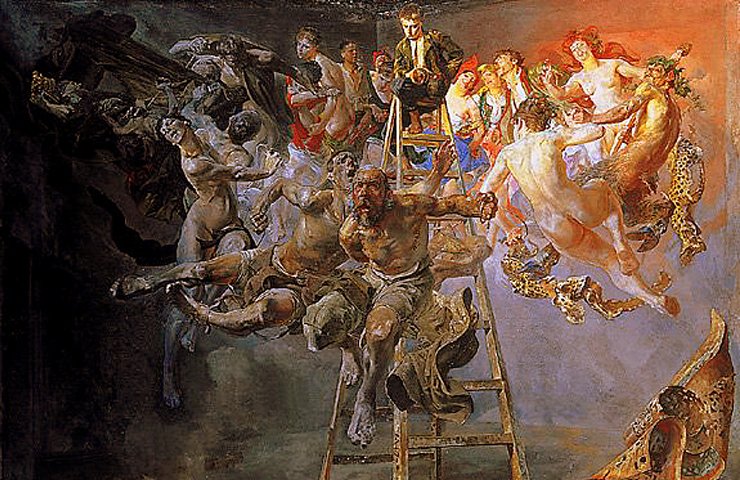
You are a GUI agent. You are given a task and a screenshot of the screen. Output one action in this format:
    pyautogui.click(x=<x>, y=<y>)
    Task: Click on the brown paint
    
    Given the screenshot: What is the action you would take?
    pyautogui.click(x=255, y=408)